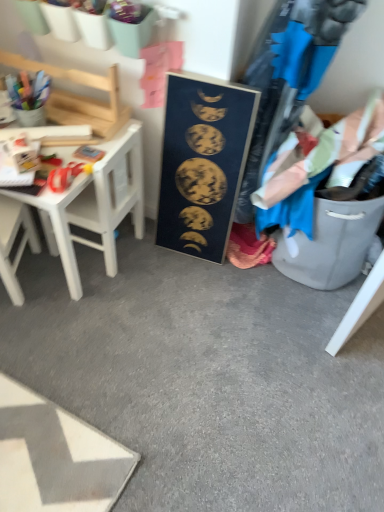
Where is `free point to the right of white plastic chair at left`? free point to the right of white plastic chair at left is located at coordinates (54, 291).